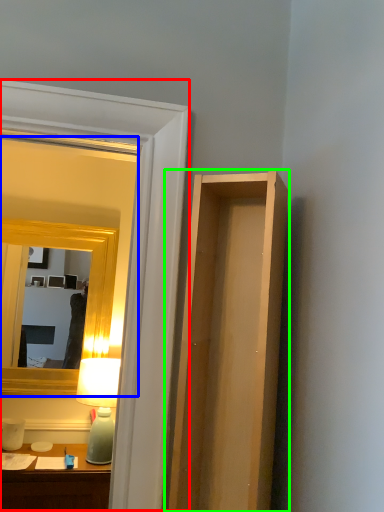
Question: Estimate the real-world distances between objects in this image. Which object is closer to glass door (highlighted by a red box), mirror (highlighted by a blue box) or cabinet (highlighted by a green box)?

Choices:
 (A) mirror
 (B) cabinet

Answer: (B)